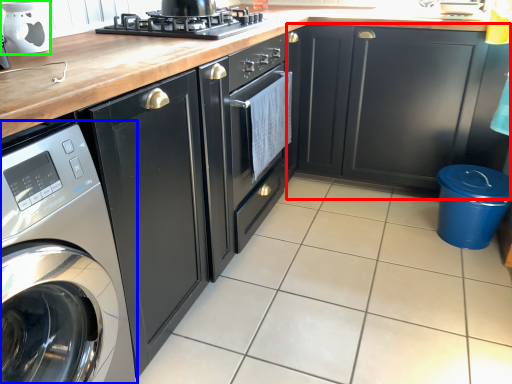
Question: Which is farther away from cabinetry (highlighted by a red box)? home appliance (highlighted by a blue box) or appliance (highlighted by a green box)?

Choices:
 (A) home appliance
 (B) appliance

Answer: (A)